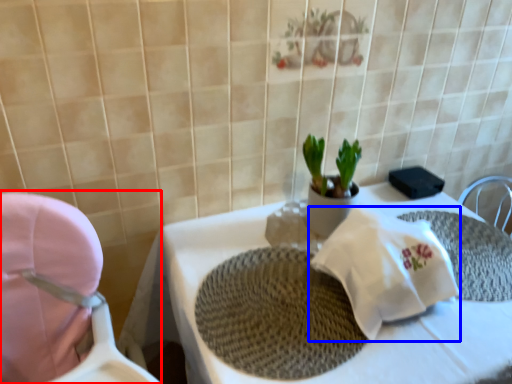
Question: Among these objects, which one is nearest to the camera, baby carriage (highlighted by a red box) or material (highlighted by a blue box)?

Choices:
 (A) baby carriage
 (B) material

Answer: (A)